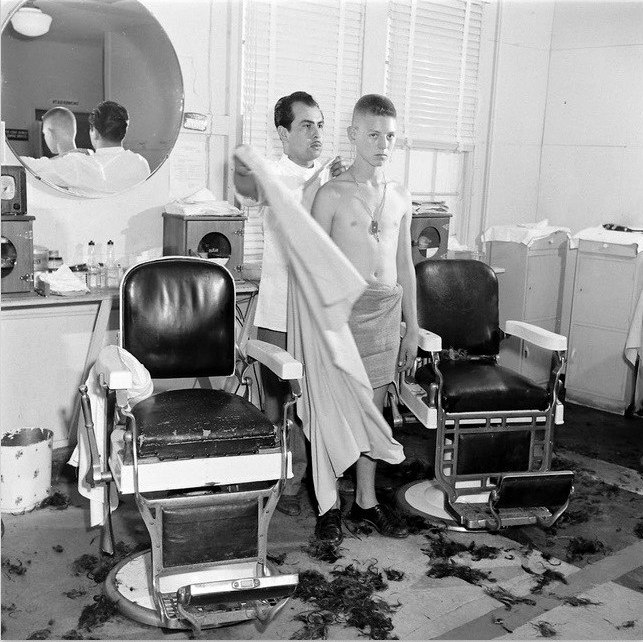
Where is `doors`? This screenshot has height=642, width=643. doors is located at coordinates (229, 241), (1, 268).